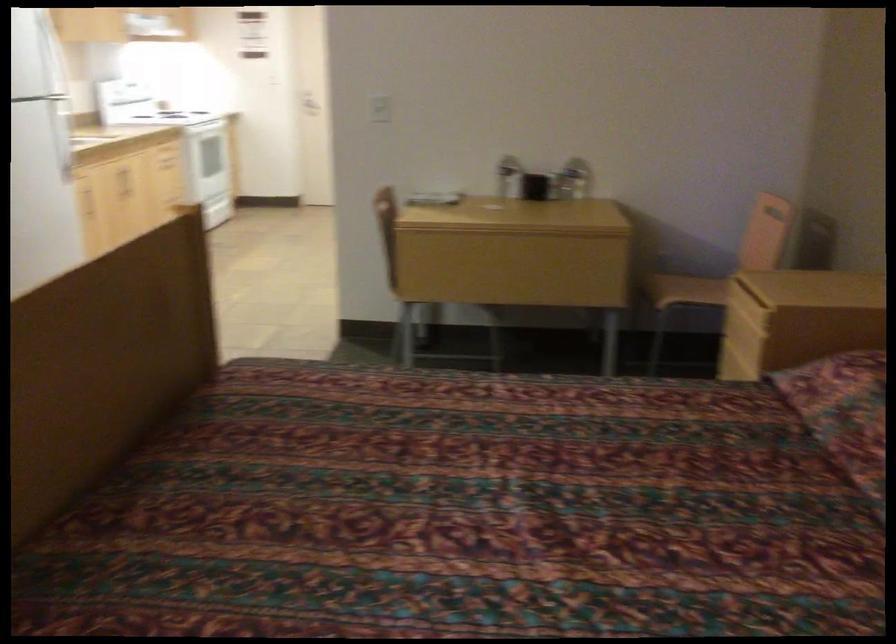
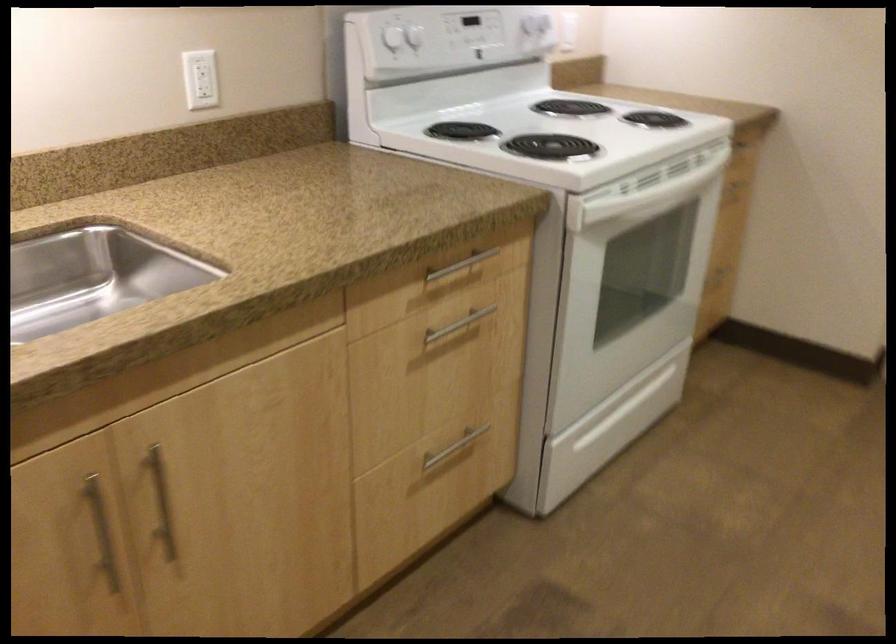
Locate, in the second image, the point that corresponds to (122,176) in the first image.

(101, 532)